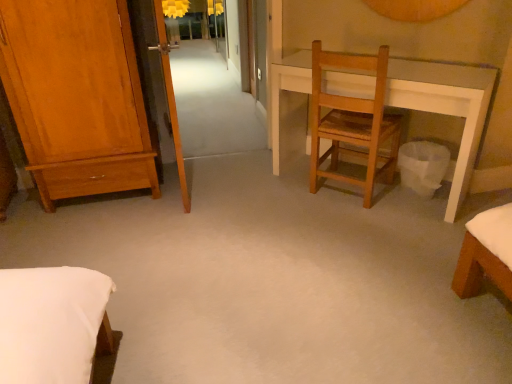
What are the coordinates of `free space in front of transparent glass screen door at upper left` in the screenshot? It's located at (172, 230).